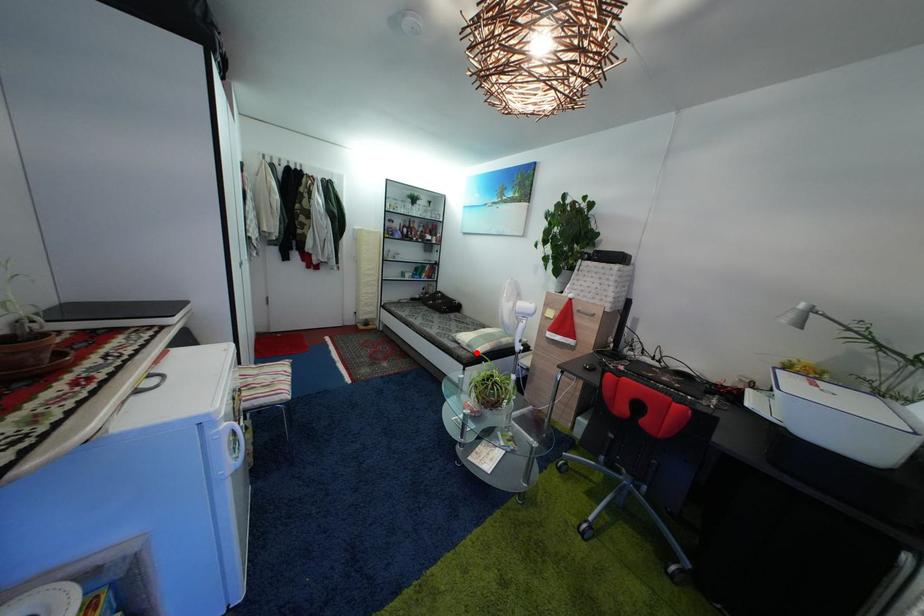
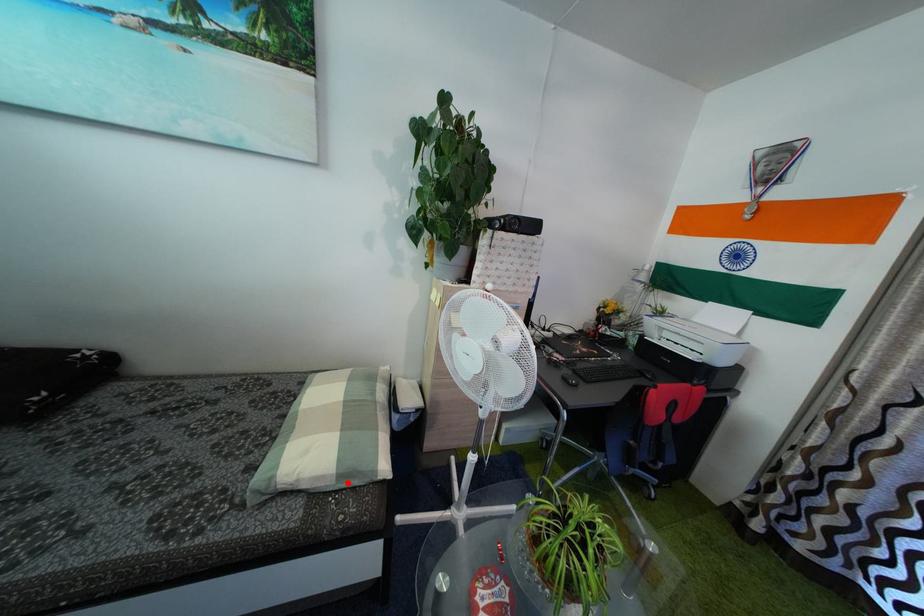
I am providing you with two images of the same scene from different viewpoints. A red point is marked on the first image and another point is marked on the second image. Is the marked point in image1 the same physical position as the marked point in image2?

Yes